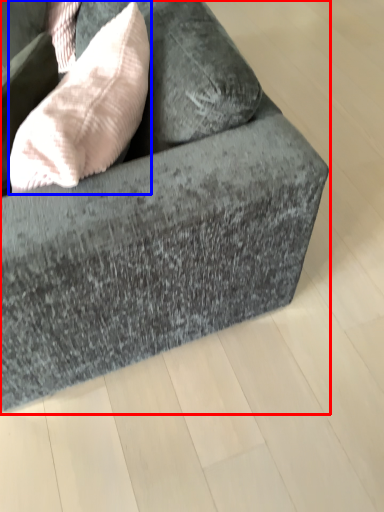
Question: Which point is closer to the camera, studio couch (highlighted by a red box) or throw pillow (highlighted by a blue box)?

Choices:
 (A) studio couch
 (B) throw pillow

Answer: (A)